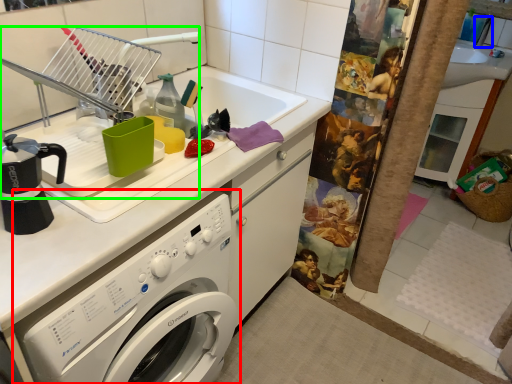
Question: Estimate the real-world distances between objects in this image. Which object is closer to washing machine (highlighted by a red box), faucet (highlighted by a blue box) or appliance (highlighted by a green box)?

Choices:
 (A) faucet
 (B) appliance

Answer: (B)